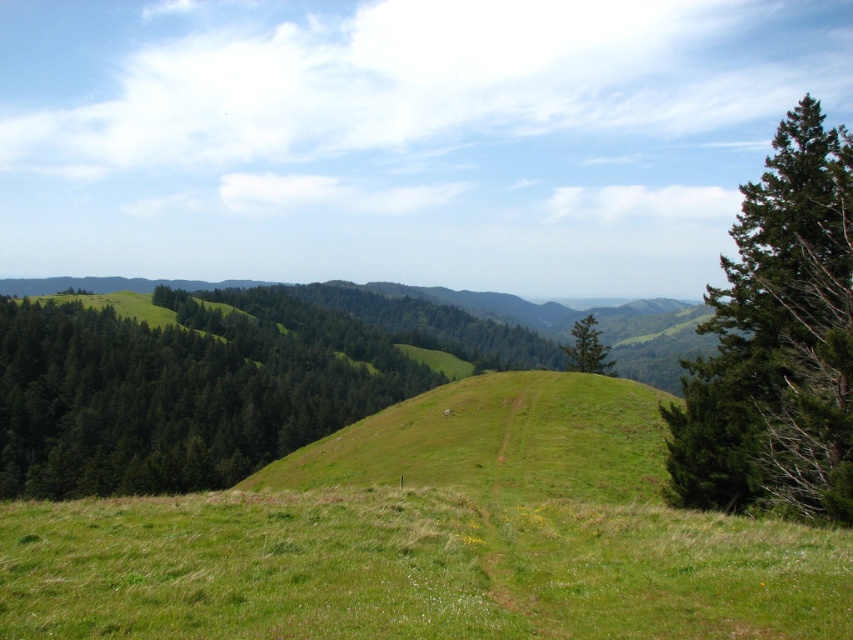
You are a hiker trying to navigate through the hills. You see a green matte tree at left and a green textured tree at center. Which tree would you choose as a landmark if you want to mark a higher elevation point?

The green matte tree at left is much taller than the green textured tree at center, so it would be a better landmark for marking a higher elevation point since taller trees often indicate higher ground.